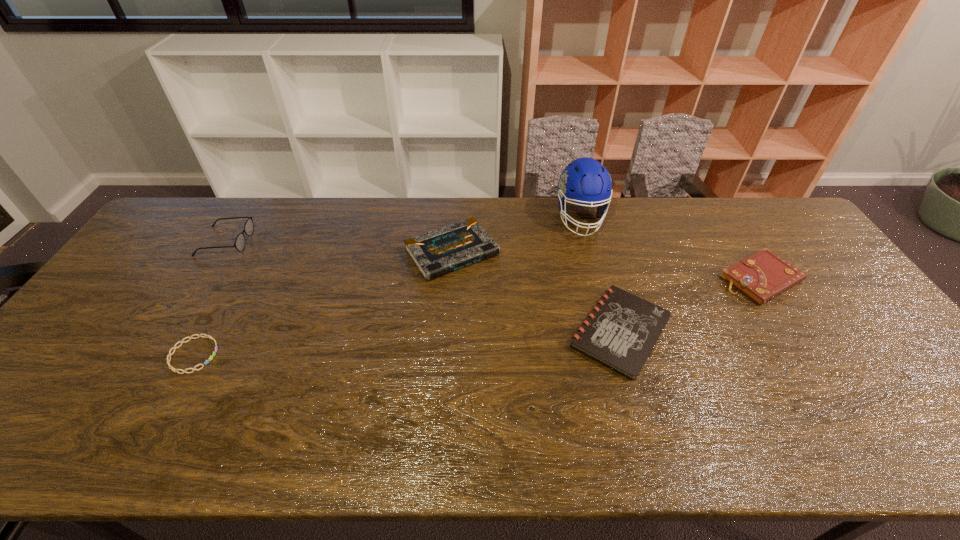
This screenshot has height=540, width=960. In order to click on vacant space situated on the right of the rightmost notebook in this screenshot , I will do `click(819, 279)`.

You are a GUI agent. You are given a task and a screenshot of the screen. Output one action in this format:
    pyautogui.click(x=<x>, y=<y>)
    Task: Click on the vacant space located 0.190m on the front of the second notebook from right to left
    The image size is (960, 540).
    Given the screenshot: What is the action you would take?
    pyautogui.click(x=656, y=460)

This screenshot has height=540, width=960. Find the location of `free space located on the surface of the bracelet showing star-shaped elements`. free space located on the surface of the bracelet showing star-shaped elements is located at coordinates (280, 355).

I want to click on football helmet located in the far edge section of the desktop, so click(585, 181).

Locate an element on the screen. This screenshot has height=540, width=960. spectacles that is at the far edge is located at coordinates (239, 244).

Find the location of `notebook that is at the far edge`. notebook that is at the far edge is located at coordinates (436, 253).

I want to click on object positioned at the right edge, so click(764, 275).

This screenshot has height=540, width=960. In the image, there is a desktop. Identify the location of free space at the far edge. (422, 211).

The image size is (960, 540). Find the location of `free space at the near edge`. free space at the near edge is located at coordinates (885, 448).

The width and height of the screenshot is (960, 540). I want to click on vacant space at the left edge, so click(x=94, y=316).